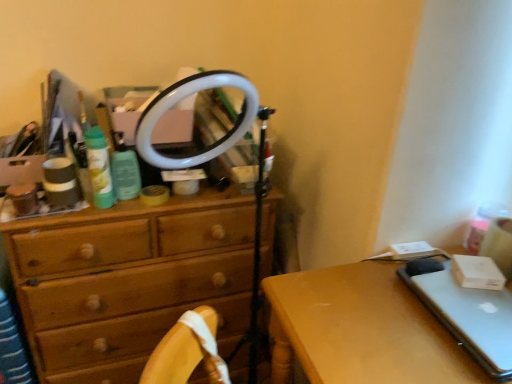
Question: Does wooden chest of drawers at center contain silver metallic laptop at right?

Choices:
 (A) no
 (B) yes

Answer: (A)

Question: Can you confirm if wooden chest of drawers at center is thinner than silver metallic laptop at right?

Choices:
 (A) yes
 (B) no

Answer: (B)

Question: Is wooden chest of drawers at center positioned with its back to silver metallic laptop at right?

Choices:
 (A) no
 (B) yes

Answer: (A)

Question: Can you confirm if wooden chest of drawers at center is positioned to the right of silver metallic laptop at right?

Choices:
 (A) no
 (B) yes

Answer: (A)

Question: Is wooden chest of drawers at center located outside silver metallic laptop at right?

Choices:
 (A) no
 (B) yes

Answer: (B)

Question: Is point (443, 357) positioned closer to the camera than point (121, 327)?

Choices:
 (A) farther
 (B) closer

Answer: (B)

Question: In the image, is silver metallic desk at lower right positioned in front of or behind wooden drawer at center?

Choices:
 (A) behind
 (B) front

Answer: (A)

Question: Is silver metallic desk at lower right wider or thinner than wooden drawer at center?

Choices:
 (A) wide
 (B) thin

Answer: (A)

Question: From a real-world perspective, relative to wooden drawer at center, is silver metallic desk at lower right vertically above or below?

Choices:
 (A) above
 (B) below

Answer: (B)

Question: From a real-world perspective, relative to silver metallic laptop at right, is wooden drawer at center vertically above or below?

Choices:
 (A) below
 (B) above

Answer: (A)

Question: Considering the relative positions of wooden drawer at center and silver metallic laptop at right in the image provided, is wooden drawer at center to the left or to the right of silver metallic laptop at right?

Choices:
 (A) right
 (B) left

Answer: (B)

Question: Is wooden drawer at center inside the boundaries of silver metallic laptop at right, or outside?

Choices:
 (A) outside
 (B) inside

Answer: (A)

Question: Relative to silver metallic laptop at right, is wooden drawer at center in front or behind?

Choices:
 (A) front
 (B) behind

Answer: (A)

Question: Does point (429, 289) appear closer or farther from the camera than point (188, 292)?

Choices:
 (A) farther
 (B) closer

Answer: (B)

Question: Is silver metallic laptop at right spatially inside wooden chest of drawers at center, or outside of it?

Choices:
 (A) inside
 (B) outside

Answer: (B)